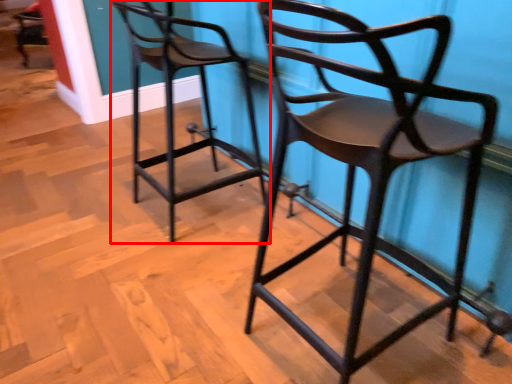
Question: From the image's perspective, what is the correct spatial relationship of chair (annotated by the red box) in relation to chair?

Choices:
 (A) below
 (B) above

Answer: (B)